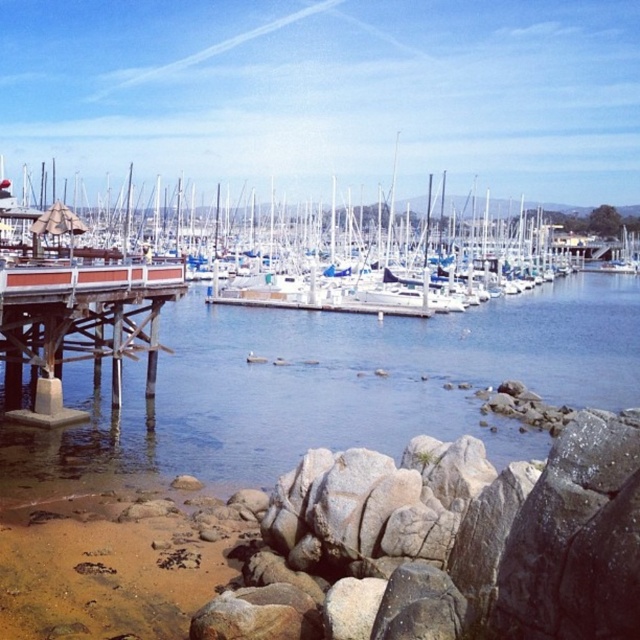
You are standing on the rocky shoreline and want to reach the white matte dock at left. Which direction should you walk to avoid stepping into the clear water at lower left?

You should walk to the right of the white matte dock at left to avoid stepping into the clear water at lower left, since the clear water at lower left is located below it.

You are standing on the rocky shoreline and want to reach the white matte dock at left. Which direction should you head from the brown wooden dock at lower left?

You should head to the right from the brown wooden dock at lower left to reach the white matte dock at left since the white matte dock at left is positioned to the right of the brown wooden dock at lower left.